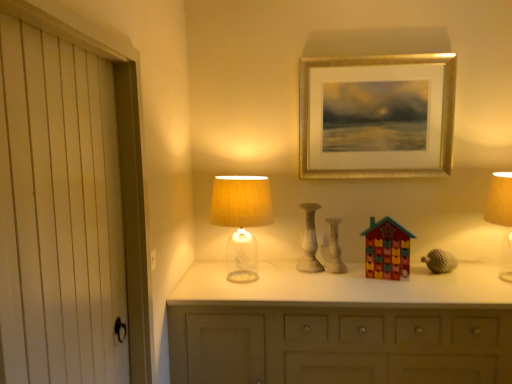
Question: Are matte gray acorn at right and matte ceramic house at center, which ranks as the second toy in right-to-left order, making contact?

Choices:
 (A) no
 (B) yes

Answer: (A)

Question: Is matte ceramic house at center, which ranks as the second toy in right-to-left order, surrounded by matte gray acorn at right?

Choices:
 (A) no
 (B) yes

Answer: (A)

Question: Considering the relative sizes of matte gray acorn at right and matte ceramic house at center, the 2th toy when ordered from front to back, in the image provided, is matte gray acorn at right taller than matte ceramic house at center, the 2th toy when ordered from front to back,?

Choices:
 (A) yes
 (B) no

Answer: (B)

Question: Is matte gray acorn at right further to camera compared to matte ceramic house at center, which ranks as the second toy in right-to-left order?

Choices:
 (A) no
 (B) yes

Answer: (A)

Question: Is matte gray acorn at right at the right side of matte ceramic house at center, marked as the 1th toy in a back-to-front arrangement?

Choices:
 (A) no
 (B) yes

Answer: (B)

Question: Is white marble candle holder at center inside the boundaries of gold metallic picture frame at upper center, or outside?

Choices:
 (A) inside
 (B) outside

Answer: (B)

Question: Considering the positions of white marble candle holder at center and gold metallic picture frame at upper center in the image, is white marble candle holder at center taller or shorter than gold metallic picture frame at upper center?

Choices:
 (A) short
 (B) tall

Answer: (A)

Question: From the image's perspective, is white marble candle holder at center above or below gold metallic picture frame at upper center?

Choices:
 (A) below
 (B) above

Answer: (A)

Question: Considering the positions of white marble candle holder at center and gold metallic picture frame at upper center in the image, is white marble candle holder at center bigger or smaller than gold metallic picture frame at upper center?

Choices:
 (A) small
 (B) big

Answer: (A)

Question: Considering the positions of matte ceramic house at center, which ranks as the second toy in right-to-left order, and gold metallic picture frame at upper center in the image, is matte ceramic house at center, which ranks as the second toy in right-to-left order, wider or thinner than gold metallic picture frame at upper center?

Choices:
 (A) wide
 (B) thin

Answer: (A)

Question: Based on their positions, is matte ceramic house at center, placed as the 1th toy when sorted from left to right, located to the left or right of gold metallic picture frame at upper center?

Choices:
 (A) right
 (B) left

Answer: (B)

Question: From the image's perspective, is matte ceramic house at center, marked as the 1th toy in a back-to-front arrangement, above or below gold metallic picture frame at upper center?

Choices:
 (A) above
 (B) below

Answer: (B)

Question: From a real-world perspective, is matte ceramic house at center, placed as the 1th toy when sorted from left to right, above or below gold metallic picture frame at upper center?

Choices:
 (A) below
 (B) above

Answer: (A)

Question: Considering the positions of translucent glass lampshade at center, which is the 1th table lamp in left-to-right order, and matte gray acorn at right in the image, is translucent glass lampshade at center, which is the 1th table lamp in left-to-right order, taller or shorter than matte gray acorn at right?

Choices:
 (A) tall
 (B) short

Answer: (A)

Question: Would you say translucent glass lampshade at center, which is the 1th table lamp in left-to-right order, is inside or outside matte gray acorn at right?

Choices:
 (A) outside
 (B) inside

Answer: (A)